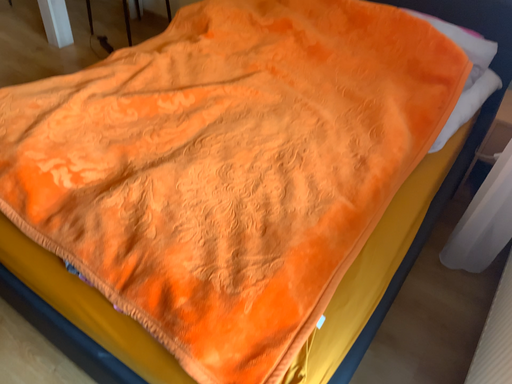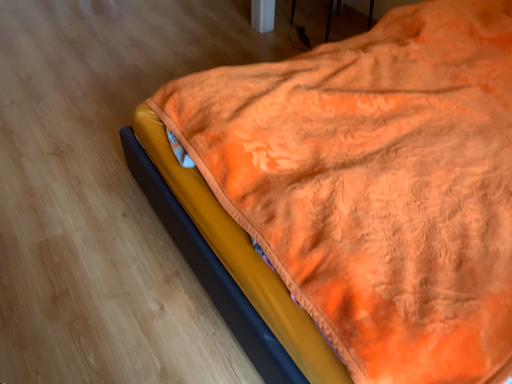
Question: How did the camera likely rotate when shooting the video?

Choices:
 (A) rotated left
 (B) rotated right

Answer: (A)